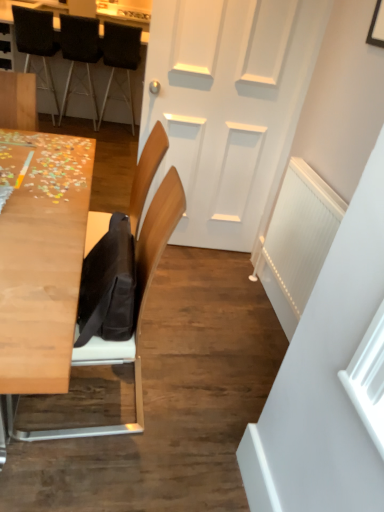
Question: Based on their positions, is black fabric chair at upper left, positioned as the 2th chair in back-to-front order, located to the left or right of dark brown leather chair at upper left, the 2th chair from the front?

Choices:
 (A) right
 (B) left

Answer: (A)

Question: From the image's perspective, is black fabric chair at upper left, positioned as the 2th chair in back-to-front order, positioned above or below dark brown leather chair at upper left, which is counted as the 3th chair, starting from the back?

Choices:
 (A) below
 (B) above

Answer: (A)

Question: Which of these objects is positioned closest to the white plastic radiator at right?

Choices:
 (A) dark brown leather chair at upper left, which is counted as the 3th chair, starting from the back
 (B) white matte door at center
 (C) black fabric chair at upper left, which is the first chair from back to front
 (D) black fabric chair at upper left, positioned as the 2th chair in back-to-front order
 (E) light wood table at left, the 1th table when ordered from front to back

Answer: (B)

Question: Considering the real-world distances, which object is farthest from the white matte door at center?

Choices:
 (A) black fabric chair at upper left, positioned as the fourth chair in front-to-back order
 (B) black fabric chair at upper left, the third chair in the front-to-back sequence
 (C) dark brown leather chair at upper left, which is counted as the 3th chair, starting from the back
 (D) wooden puzzle pieces at upper left, which ranks as the second table in bottom-to-top order
 (E) white plastic radiator at right

Answer: (C)